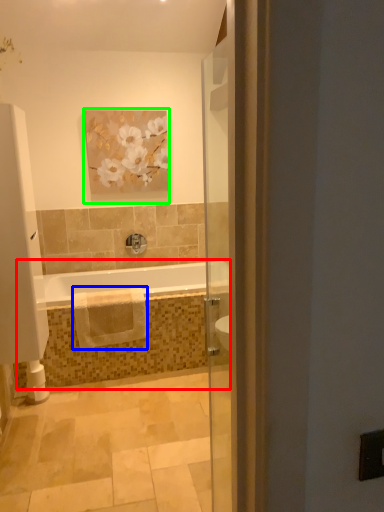
Question: Considering the real-world distances, which object is closest to bath (highlighted by a red box)? material (highlighted by a blue box) or picture frame (highlighted by a green box).

Choices:
 (A) material
 (B) picture frame

Answer: (A)